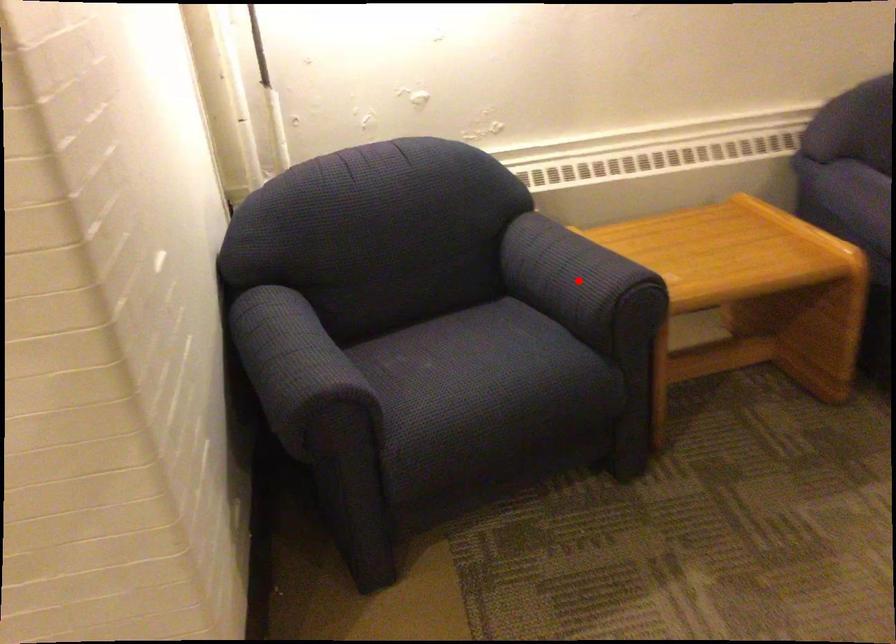
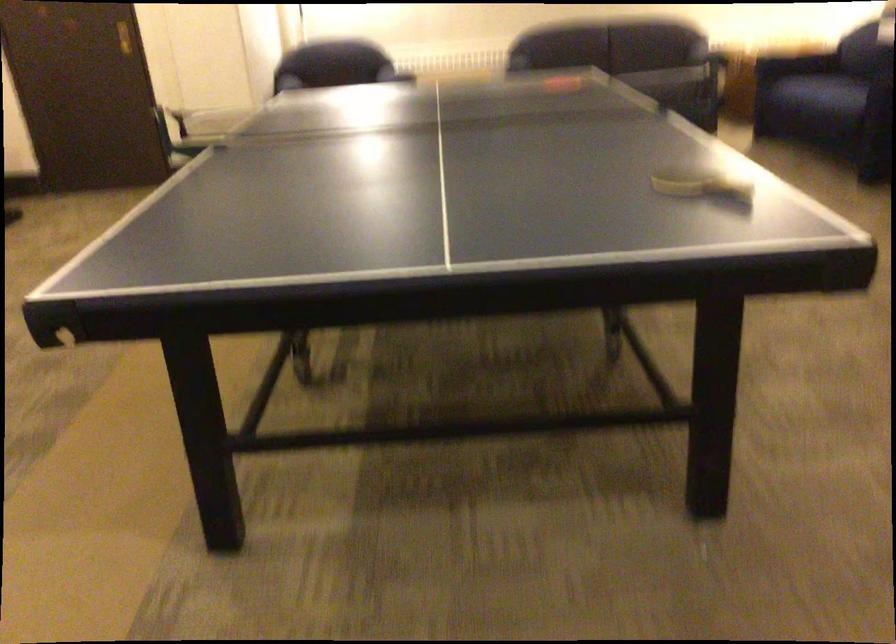
Question: I am providing you with two images of the same scene from different viewpoints. A red point is marked on the first image. At the location where the point appears in image 1, is it still visible in image 2?

Choices:
 (A) Yes
 (B) No

Answer: (B)